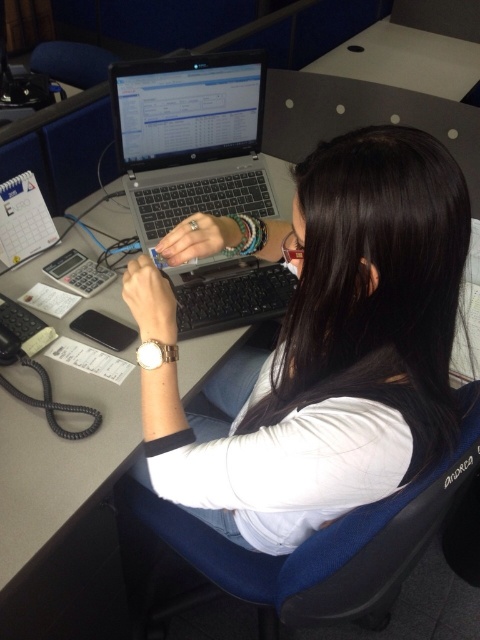
You are organizing a meeting and need to place a 1.2 meter long tablecloth on the white plastic table at upper center. Given the spatial relationship between the blue fabric chair at center and the table, will the tablecloth fit without overlapping the chair?

The blue fabric chair at center is to the left of the white plastic table at upper center. Since the tablecloth is 1.2 meters long and the chair is positioned to the left of the table, the tablecloth may extend beyond the table but will not overlap the chair as they are aligned horizontally. However, without knowing the table dimensions, it is uncertain if the tablecloth will fit properly.